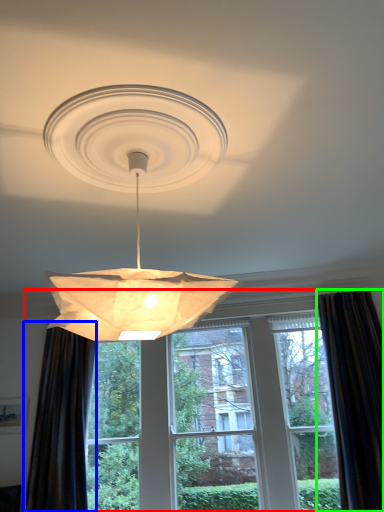
Question: Which object is the farthest from window (highlighted by a red box)? Choose among these: curtain (highlighted by a blue box) or curtain (highlighted by a green box).

Choices:
 (A) curtain
 (B) curtain

Answer: (B)